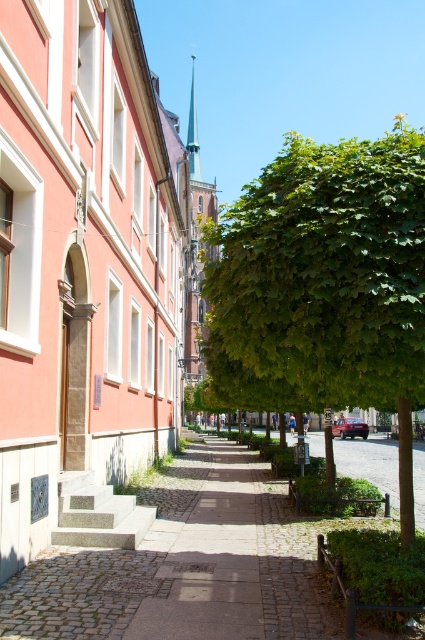
Who is more forward, (325, 451) or (235, 577)?

Positioned in front is point (235, 577).

You are a GUI agent. You are given a task and a screenshot of the screen. Output one action in this format:
    pyautogui.click(x=<x>, y=<y>)
    Task: Click on the green leafy tree at center
    This screenshot has height=640, width=425.
    Given the screenshot: What is the action you would take?
    pyautogui.click(x=331, y=278)